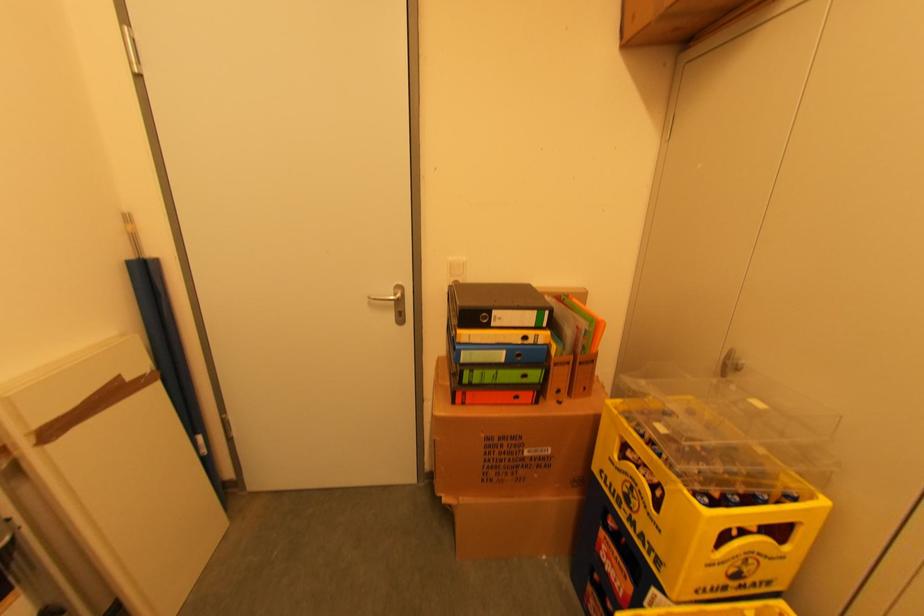
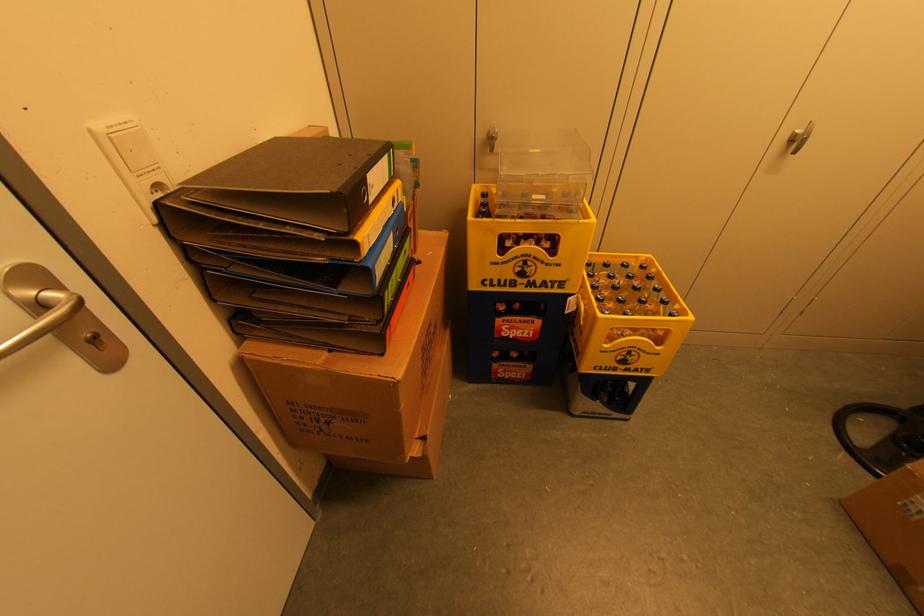
In the second image, find the point that corresponds to the point at 497,315 in the first image.

(371, 185)